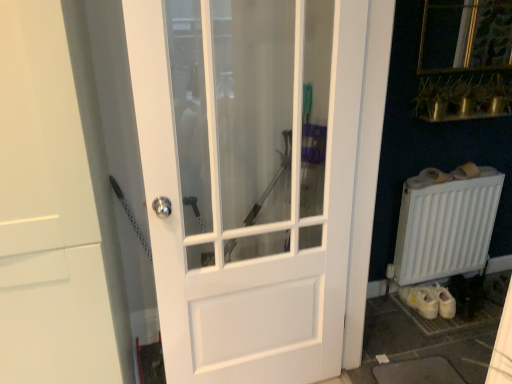
Question: Can white glossy door at center, the first door when ordered from left to right, be found inside white glossy door at center, arranged as the 2th door when viewed from the left?

Choices:
 (A) yes
 (B) no

Answer: (B)

Question: Does white glossy door at center, which appears as the first door when viewed from the right, have a lesser width compared to white glossy door at center, which is the 2th door in right-to-left order?

Choices:
 (A) no
 (B) yes

Answer: (B)

Question: Is white glossy door at center, arranged as the 2th door when viewed from the left, closer to the viewer compared to white glossy door at center, the first door when ordered from left to right?

Choices:
 (A) yes
 (B) no

Answer: (B)

Question: Does white glossy door at center, arranged as the 2th door when viewed from the left, turn towards white glossy door at center, which is the 2th door in right-to-left order?

Choices:
 (A) yes
 (B) no

Answer: (B)

Question: Is white glossy door at center, arranged as the 2th door when viewed from the left, with white glossy door at center, which is the 2th door in right-to-left order?

Choices:
 (A) yes
 (B) no

Answer: (B)

Question: From the image's perspective, is white matte radiator at lower right located above or below white glossy door at center, arranged as the 2th door when viewed from the left?

Choices:
 (A) above
 (B) below

Answer: (B)

Question: Is white matte radiator at lower right in front of or behind white glossy door at center, arranged as the 2th door when viewed from the left, in the image?

Choices:
 (A) front
 (B) behind

Answer: (B)

Question: Considering the positions of white matte radiator at lower right and white glossy door at center, arranged as the 2th door when viewed from the left, in the image, is white matte radiator at lower right bigger or smaller than white glossy door at center, arranged as the 2th door when viewed from the left,?

Choices:
 (A) small
 (B) big

Answer: (A)

Question: Is white matte radiator at lower right wider or thinner than white glossy door at center, which appears as the first door when viewed from the right?

Choices:
 (A) wide
 (B) thin

Answer: (A)

Question: Considering the positions of white glossy door at center, which is the 2th door in right-to-left order, and white matte radiator at lower right in the image, is white glossy door at center, which is the 2th door in right-to-left order, taller or shorter than white matte radiator at lower right?

Choices:
 (A) tall
 (B) short

Answer: (A)

Question: From a real-world perspective, is white glossy door at center, the first door when ordered from left to right, above or below white matte radiator at lower right?

Choices:
 (A) below
 (B) above

Answer: (B)

Question: In terms of width, does white glossy door at center, which is the 2th door in right-to-left order, look wider or thinner when compared to white matte radiator at lower right?

Choices:
 (A) wide
 (B) thin

Answer: (A)

Question: Is white glossy door at center, the first door when ordered from left to right, bigger or smaller than white matte radiator at lower right?

Choices:
 (A) small
 (B) big

Answer: (B)

Question: From their relative heights in the image, would you say white matte radiator at lower right is taller or shorter than white glossy door at center, which is the 2th door in right-to-left order?

Choices:
 (A) tall
 (B) short

Answer: (B)

Question: Looking at the image, does white matte radiator at lower right seem bigger or smaller compared to white glossy door at center, which is the 2th door in right-to-left order?

Choices:
 (A) big
 (B) small

Answer: (B)